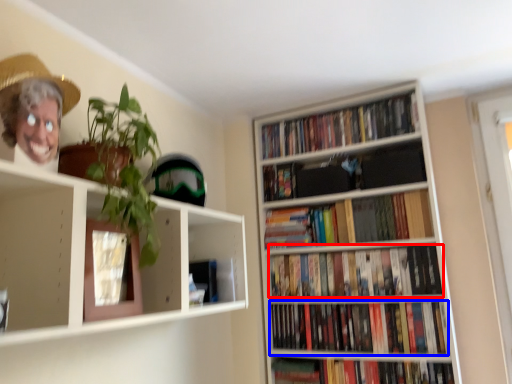
Question: Which object is further to the camera taking this photo, book (highlighted by a red box) or book (highlighted by a blue box)?

Choices:
 (A) book
 (B) book

Answer: (A)